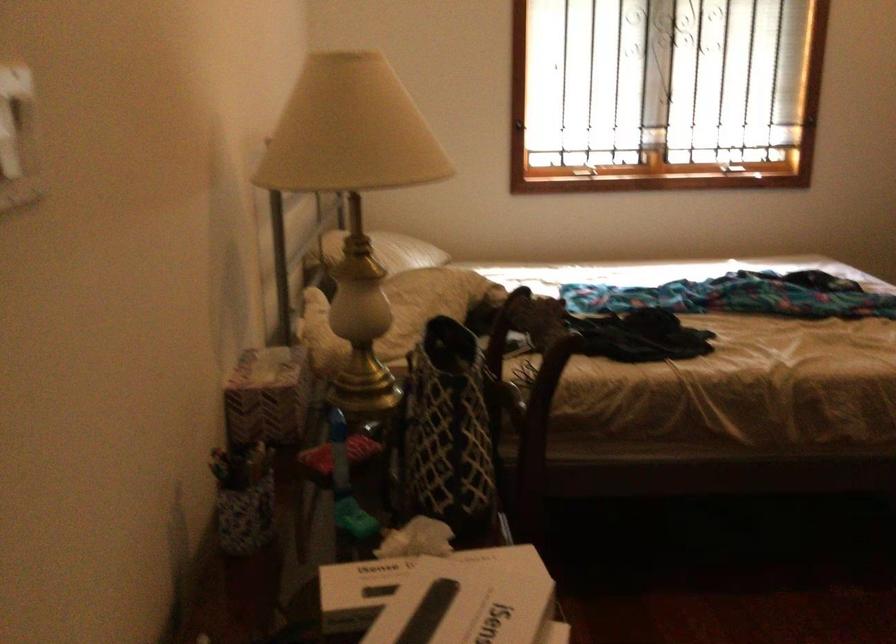
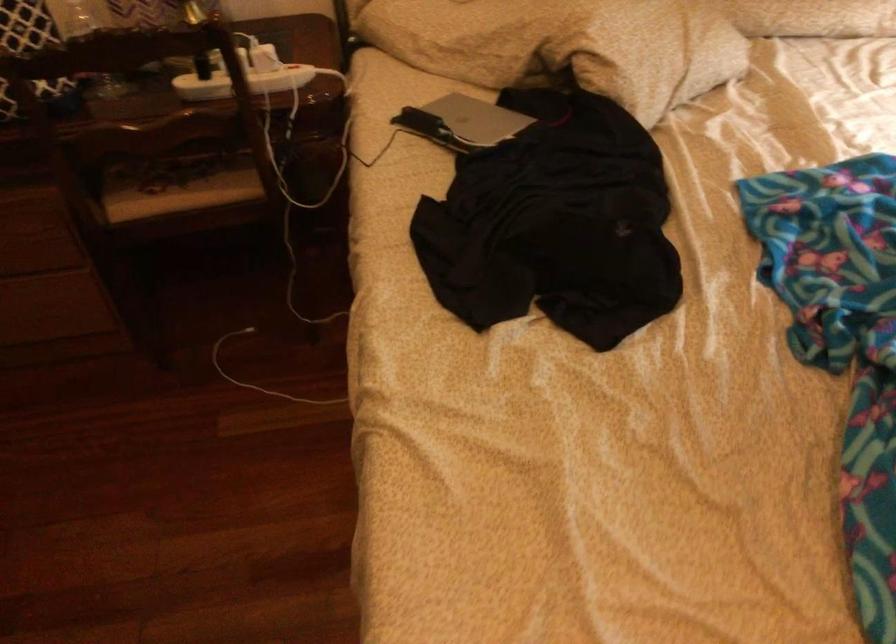
Locate, in the second image, the point that corresponds to pixel 497 355 in the first image.

(243, 82)